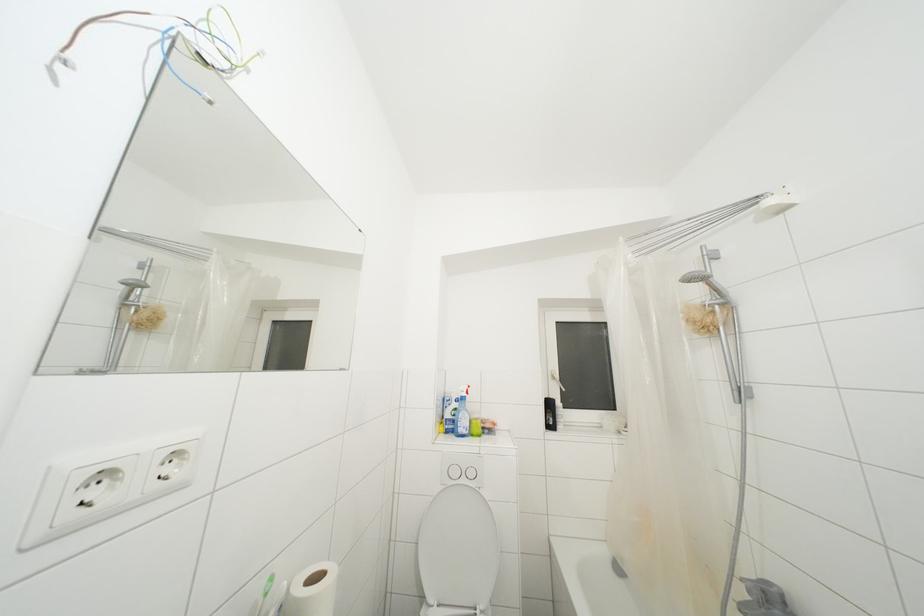
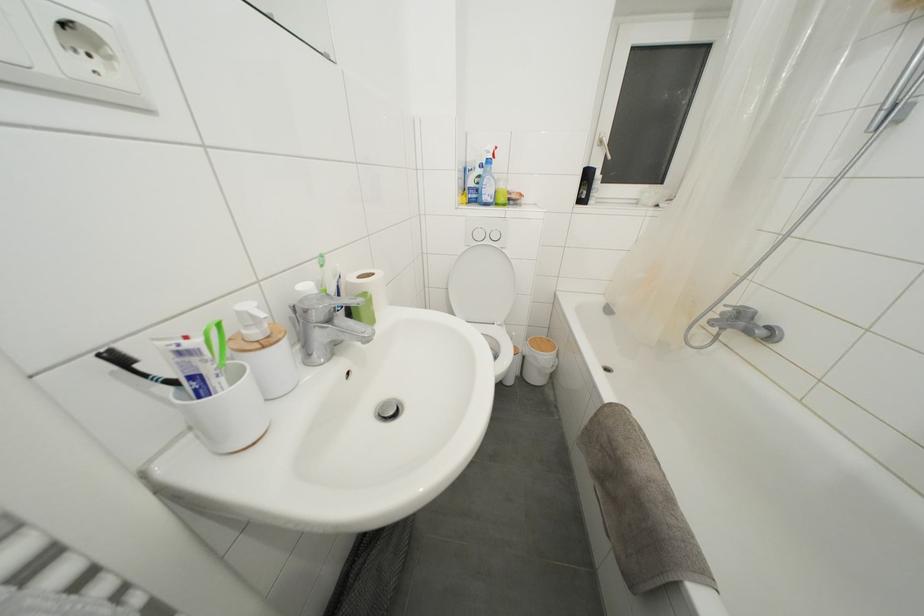
Where in the second image is the point corresponding to point (465, 435) from the first image?

(490, 203)